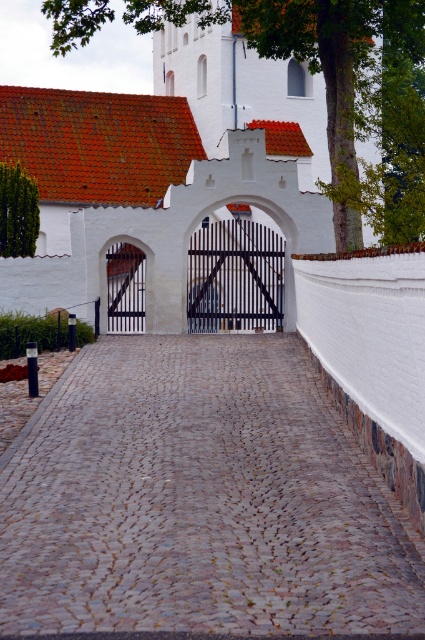
What do you see at coordinates (314, 61) in the screenshot? I see `green leafy tree at upper center` at bounding box center [314, 61].

Is green leafy tree at upper center wider than black metal gate at center?

Indeed, green leafy tree at upper center has a greater width compared to black metal gate at center.

Which is behind, point (163, 3) or point (187, 252)?

Point (187, 252)

You are a GUI agent. You are given a task and a screenshot of the screen. Output one action in this format:
    pyautogui.click(x=<x>, y=<y>)
    Task: Click on the green leafy tree at upper center
    This screenshot has width=425, height=640.
    Given the screenshot: What is the action you would take?
    [x=314, y=61]

Between green leafy tree at upper center and green leafy tree at left, which one is positioned higher?

Positioned higher is green leafy tree at upper center.

The height and width of the screenshot is (640, 425). What are the coordinates of `green leafy tree at upper center` in the screenshot? It's located at (314, 61).

The image size is (425, 640). Identify the location of green leafy tree at upper center. (314, 61).

Is green leafy tree at upper center taller than white wooden gate at center?

Correct, green leafy tree at upper center is much taller as white wooden gate at center.

Who is higher up, green leafy tree at upper center or white wooden gate at center?

Positioned higher is green leafy tree at upper center.

Does point (354, 113) come in front of point (136, 304)?

Yes, it is in front of point (136, 304).

At what (x,y) coordinates should I click in order to perform the action: click on green leafy tree at upper center. Please return your answer as a coordinate pair (x, y). The image size is (425, 640). Looking at the image, I should click on (314, 61).